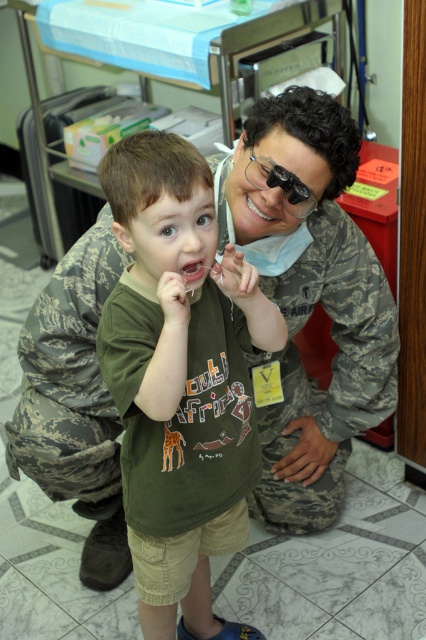
You are a robot trying to locate the point at coordinates (310,298) in the image. According to the scene description, where is this point located?

The point at coordinates (310,298) is located on the camouflage uniform at center.

You are a nurse who needs to pass a medical kit to both the camouflage uniform at center and the green matte shirt at center. The medical kit is 12 inches wide. Can you place it between them without touching either?

The camouflage uniform at center is 14.65 inches away from green matte shirt at center. Since the medical kit is 12 inches wide, placing it between them would require at least 12 inches of space. The distance between them is sufficient, so yes, you can place the medical kit between them without touching either.